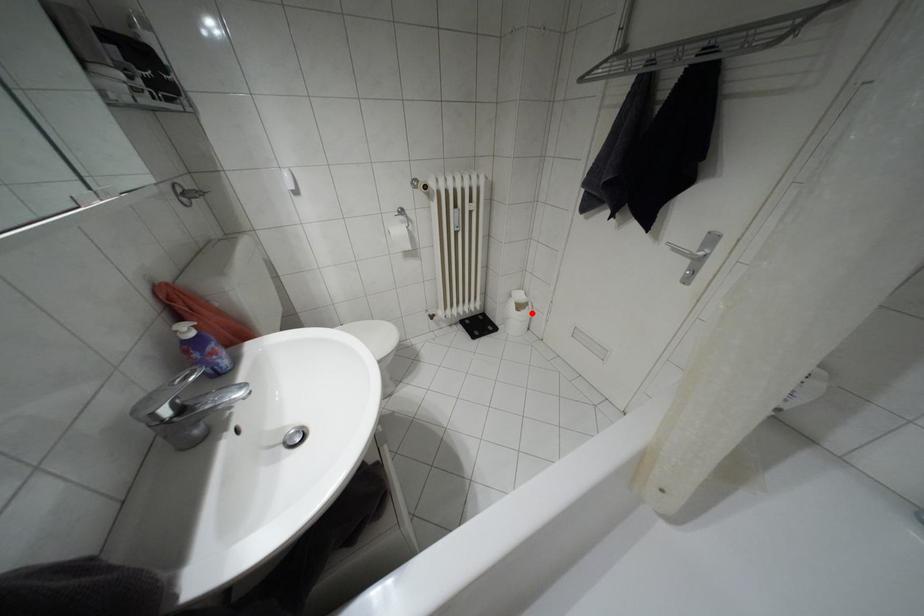
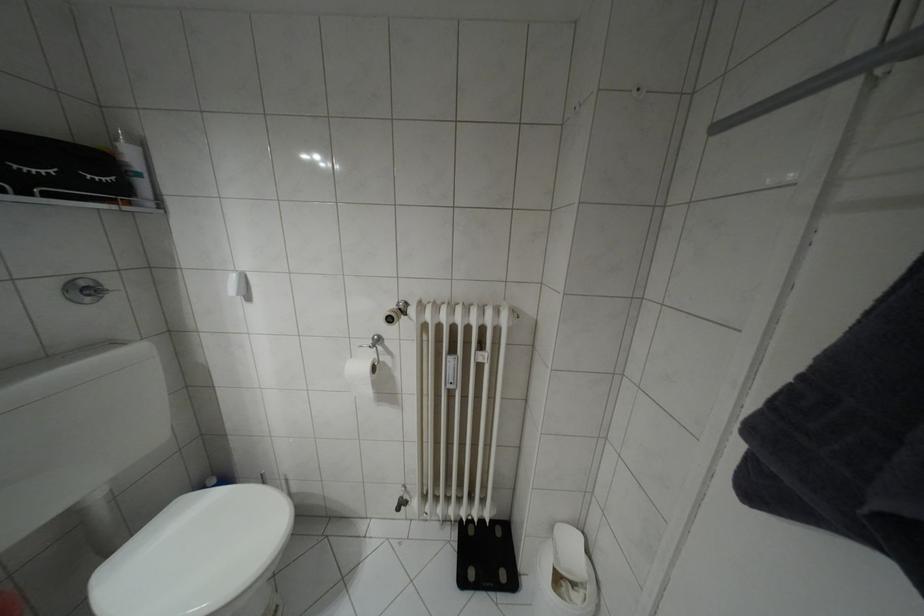
Question: I am providing you with two images of the same scene from different viewpoints. A red point is marked on the first image. At the location where the point appears in image 1, is it still visible in image 2?

Choices:
 (A) Yes
 (B) No

Answer: (A)